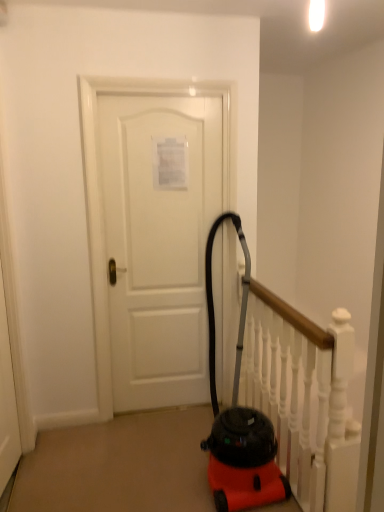
Question: Is white matte door at center inside or outside of white wooden rail at center?

Choices:
 (A) outside
 (B) inside

Answer: (A)

Question: Based on their sizes in the image, would you say white matte door at center is bigger or smaller than white wooden rail at center?

Choices:
 (A) big
 (B) small

Answer: (B)

Question: Considering the positions of white matte door at center and white wooden rail at center in the image, is white matte door at center wider or thinner than white wooden rail at center?

Choices:
 (A) thin
 (B) wide

Answer: (A)

Question: Looking at the image, does white wooden rail at center seem bigger or smaller compared to white matte door at center?

Choices:
 (A) big
 (B) small

Answer: (A)

Question: From a real-world perspective, is white wooden rail at center physically located above or below white matte door at center?

Choices:
 (A) below
 (B) above

Answer: (A)

Question: From their relative heights in the image, would you say white wooden rail at center is taller or shorter than white matte door at center?

Choices:
 (A) tall
 (B) short

Answer: (B)

Question: From the image's perspective, is white wooden rail at center above or below white matte door at center?

Choices:
 (A) above
 (B) below

Answer: (B)